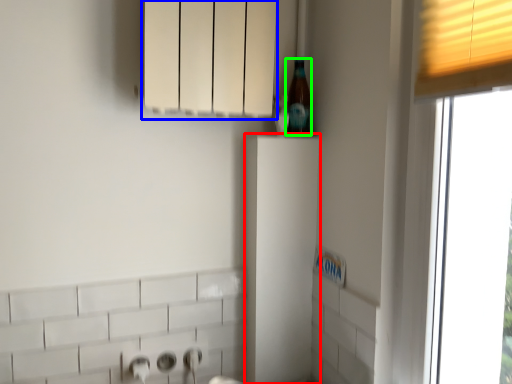
Question: Based on their relative distances, which object is nearer to cabinetry (highlighted by a red box)? Choose from cabinetry (highlighted by a blue box) and beer bottle (highlighted by a green box).

Choices:
 (A) cabinetry
 (B) beer bottle

Answer: (B)